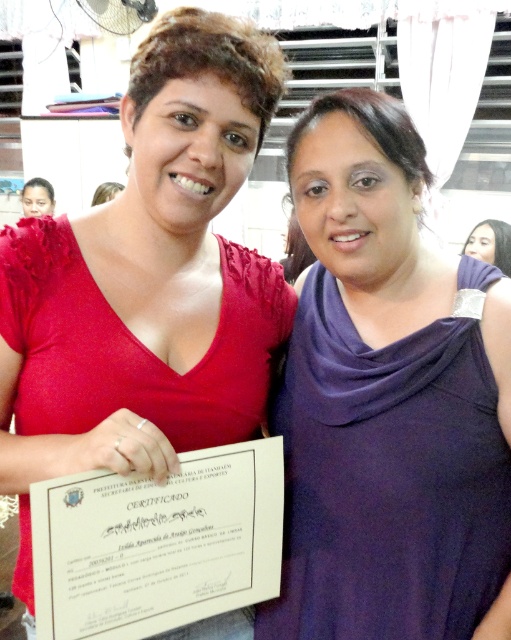
You are a photographer trying to adjust the lighting for a closeup shot of the two women. You need to ensure the purple matte scarf at upper right and the matte black hair at upper left are both visible. Based on their positions, which object is closer to the bottom of the frame?

The purple matte scarf at upper right is positioned under matte black hair at upper left, meaning it is closer to the bottom of the frame than the matte black hair at upper left.

You are a photographer at a formal event and need to ensure that both the purple matte dress at center and the white paper certificate at center are clearly visible in your photo. Based on their positions, which object should you focus on first to ensure both are in focus?

The purple matte dress at center is above the white paper certificate at center. To ensure both are in focus, you should focus on the purple matte dress at center first since it is closer to the camera, allowing the certificate below it to remain in focus as well.

You are standing in the room where the two women are. You want to walk to the matte red dress at center. Which direction should you walk to reach it?

The matte red dress at center is located at coordinates point (147, 280), so you should walk towards the center of the room to reach it.